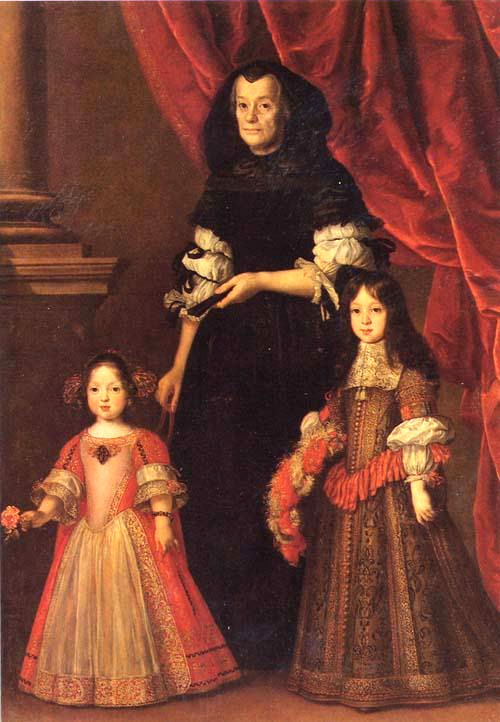
Identify the location of stage curtain. (272, 32), (428, 162), (475, 323).